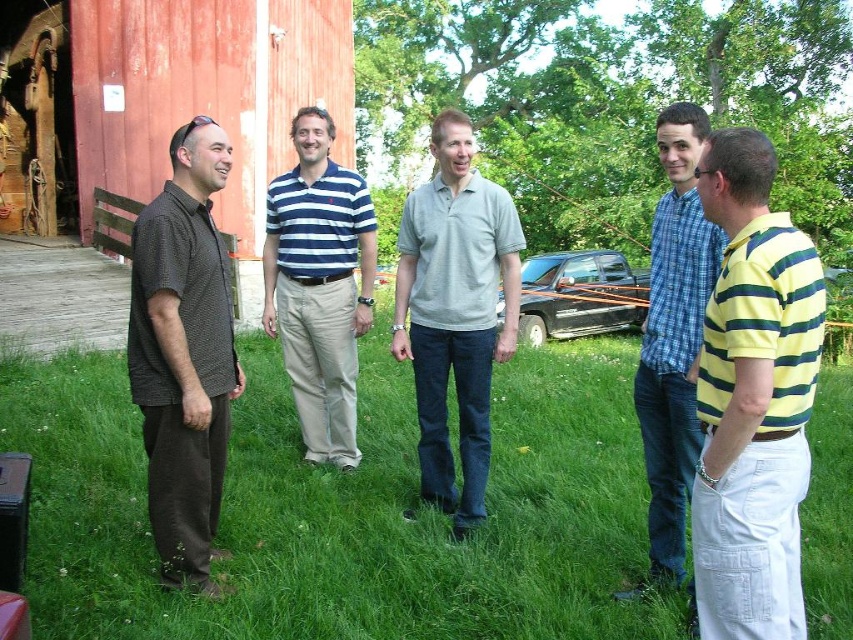
Question: Which of the following is the farthest from the observer?

Choices:
 (A) (300, 227)
 (B) (416, 316)
 (C) (624, 269)
 (D) (648, 545)

Answer: (C)

Question: Considering the real-world distances, which object is closest to the yellow-green striped polo shirt at right?

Choices:
 (A) black matte truck at center
 (B) blue plaid shirt at center
 (C) green grass at center

Answer: (B)

Question: Is green grass at center positioned at the back of blue plaid shirt at center?

Choices:
 (A) no
 (B) yes

Answer: (A)

Question: Which point is farther to the camera?

Choices:
 (A) (334, 602)
 (B) (793, 234)

Answer: (A)

Question: Does green grass at center have a lesser width compared to blue plaid shirt at center?

Choices:
 (A) yes
 (B) no

Answer: (B)

Question: Is dark brown textured shirt at left wider than black matte truck at center?

Choices:
 (A) yes
 (B) no

Answer: (B)